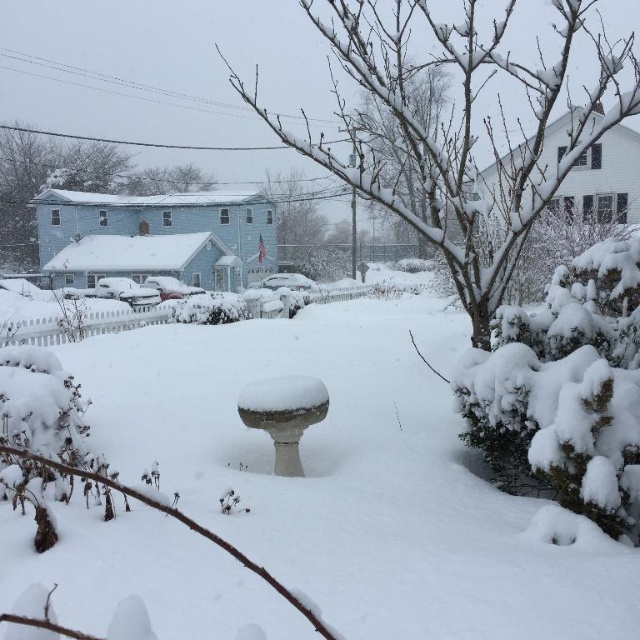
Question: Which point is farther to the camera?

Choices:
 (A) (531, 529)
 (B) (333, 84)
 (C) (173, 186)
 (D) (40, 170)

Answer: (B)

Question: Can you confirm if snow-covered tree at center is thinner than snow-covered tree at upper center?

Choices:
 (A) yes
 (B) no

Answer: (B)

Question: Which point is closer to the camera?

Choices:
 (A) pyautogui.click(x=419, y=163)
 (B) pyautogui.click(x=168, y=170)
 (C) pyautogui.click(x=12, y=200)

Answer: (A)

Question: Which point is farther to the camera?

Choices:
 (A) (177, 182)
 (B) (310, 636)
 (C) (4, 193)

Answer: (A)

Question: Is snow-covered tree at center positioned in front of snow-covered tree at upper center?

Choices:
 (A) no
 (B) yes

Answer: (B)

Question: Is white matte snow at center below snow-covered tree at center?

Choices:
 (A) no
 (B) yes

Answer: (B)